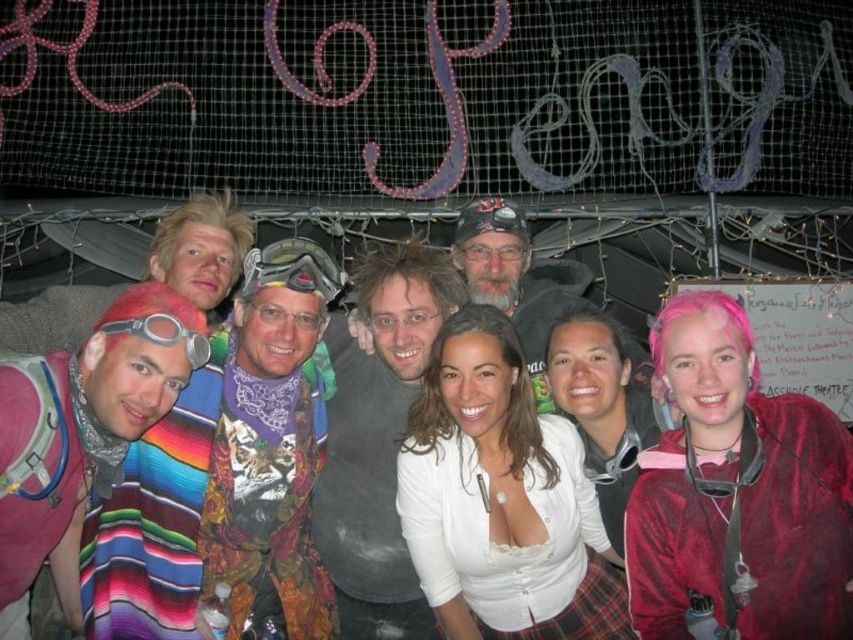
Question: Can you confirm if silver metallic goggles at left is positioned to the left of matte black goggles at center?

Choices:
 (A) no
 (B) yes

Answer: (B)

Question: Among these points, which one is nearest to the camera?

Choices:
 (A) (183, 342)
 (B) (459, 237)

Answer: (A)

Question: Is white lace top at center bigger than silver metallic goggles at left?

Choices:
 (A) no
 (B) yes

Answer: (B)

Question: Which is nearer to the multicolored woven poncho at center left?

Choices:
 (A) matte black goggles at center
 (B) white lace top at center
 (C) matte gray goggles at center

Answer: (B)

Question: Based on their relative distances, which object is farther from the white lace top at center?

Choices:
 (A) multicolored woven blanket at center
 (B) silver metallic goggles at left

Answer: (A)

Question: Can you confirm if white lace top at center is positioned to the left of silver metallic goggles at left?

Choices:
 (A) no
 (B) yes

Answer: (A)